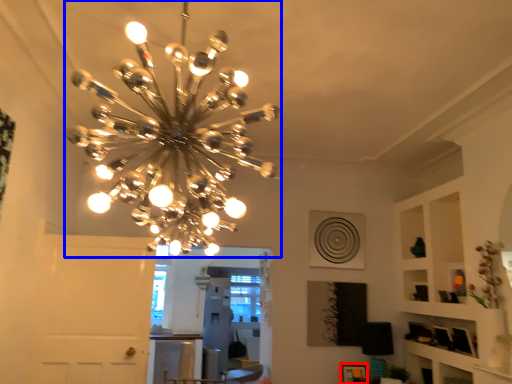
Question: Which of the following is the closest to the observer, picture frame (highlighted by a red box) or lamp (highlighted by a blue box)?

Choices:
 (A) picture frame
 (B) lamp

Answer: (B)